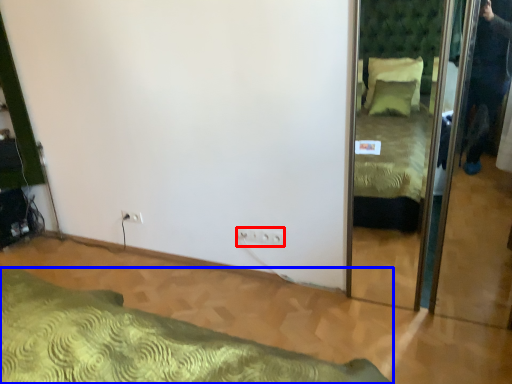
Question: Which object is closer to the camera taking this photo, electric outlet (highlighted by a red box) or bed (highlighted by a blue box)?

Choices:
 (A) electric outlet
 (B) bed

Answer: (B)